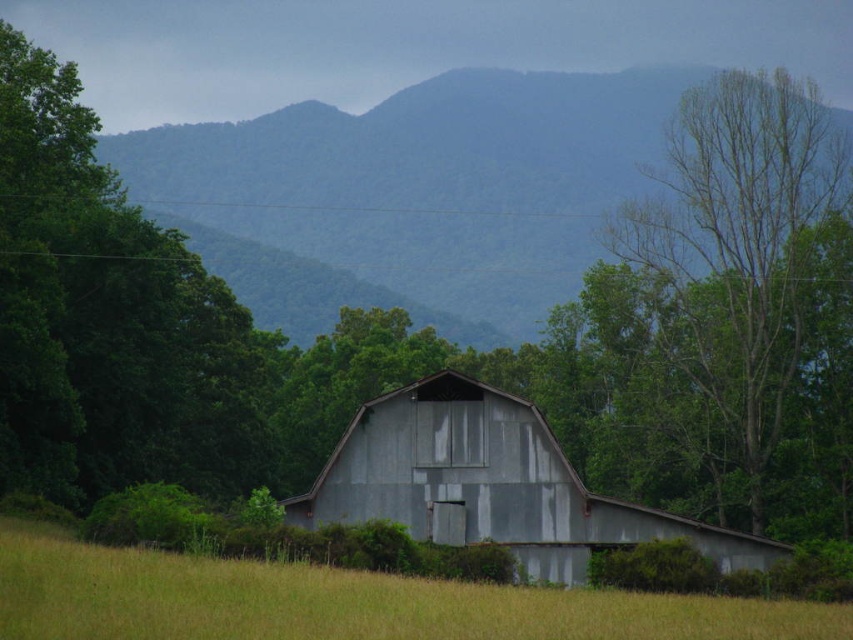
You are standing at the center of the field in front of the barn. Which direction should you walk to reach the green leafy tree at left?

The green leafy tree at left is located at point (109,320), so you should walk to the left to reach it.

In the scene shown: You are an artist planning to paint the rural landscape scene. You want to emphasize the contrast between the bare wood tree at right and the rusty metal barn at center. Which object should you make thicker in your painting to highlight this contrast?

To emphasize the contrast between the bare wood tree at right and the rusty metal barn at center, you should make the rusty metal barn at center thicker since the bare wood tree at right is naturally thinner than it.

Based on the photo, you are standing in the field of yellow grass at center and want to walk towards the barn. Which direction should you walk to avoid the bare wood tree at right?

You should walk to the left of the yellow grass at center to avoid the bare wood tree at right, since the tree is located to the right of the grass.